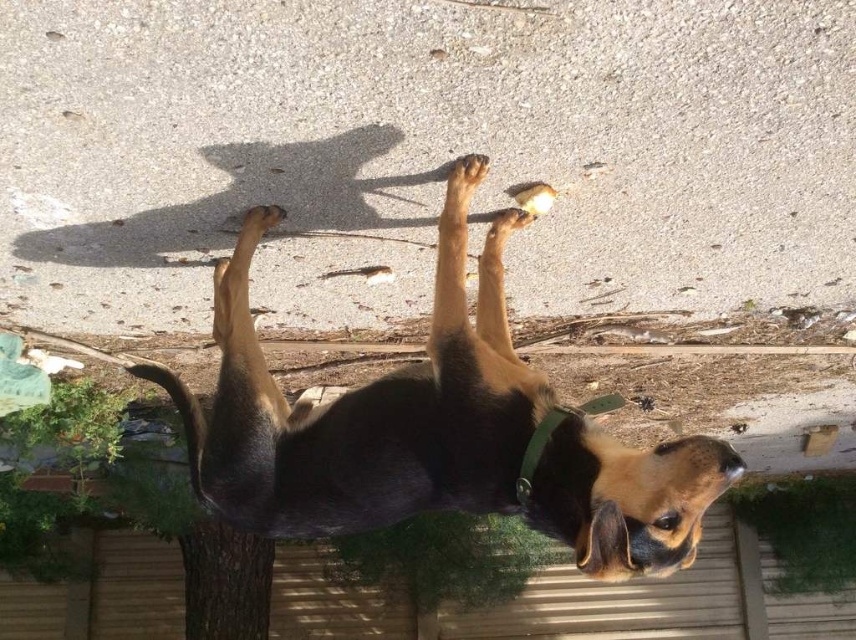
Is brown fuzzy paw at upper center taller than brown fur paw at upper center?

Yes, brown fuzzy paw at upper center is taller than brown fur paw at upper center.

Image resolution: width=856 pixels, height=640 pixels. I want to click on brown fuzzy paw at upper center, so click(467, 173).

What do you see at coordinates (467, 173) in the screenshot? The width and height of the screenshot is (856, 640). I see `brown fuzzy paw at upper center` at bounding box center [467, 173].

I want to click on brown fuzzy paw at upper center, so [467, 173].

What do you see at coordinates (434, 435) in the screenshot?
I see `black fur dog at center` at bounding box center [434, 435].

Is black fur dog at center below brown fuzzy paw at upper center?

Indeed, black fur dog at center is positioned under brown fuzzy paw at upper center.

From the picture: Measure the distance between black fur dog at center and camera.

black fur dog at center is 1.49 meters from camera.

In order to click on black fur dog at center in this screenshot , I will do `click(434, 435)`.

In the scene shown: Does black fur dog at center appear under brown fur paw at upper center?

Indeed, black fur dog at center is positioned under brown fur paw at upper center.

Is black fur dog at center to the left of brown fur paw at upper center from the viewer's perspective?

Yes, black fur dog at center is to the left of brown fur paw at upper center.

Identify the location of black fur dog at center. The image size is (856, 640). (434, 435).